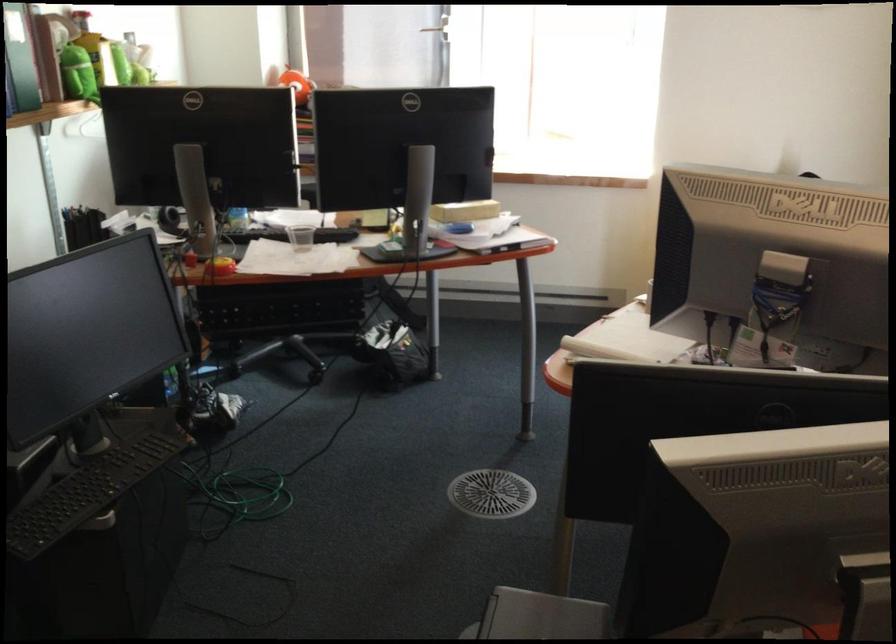
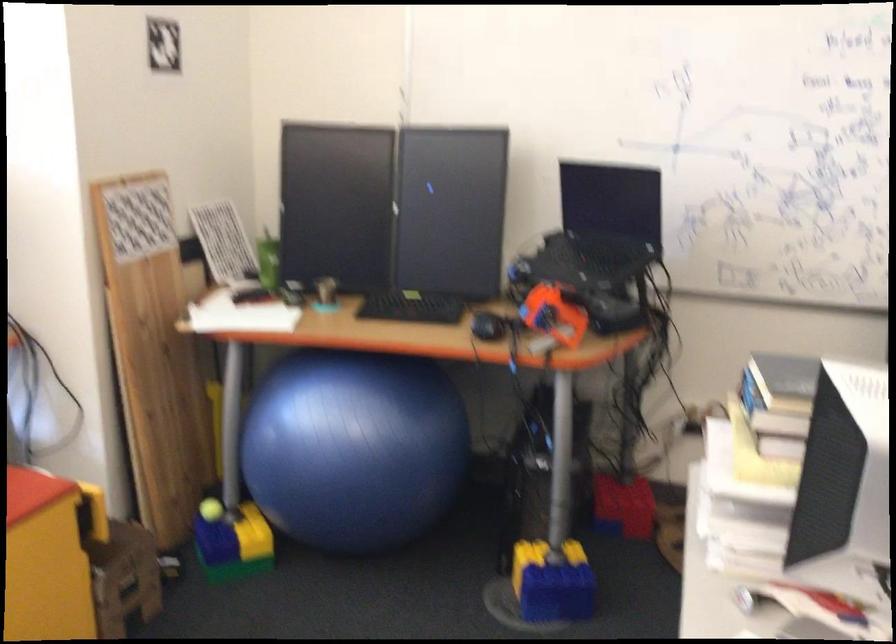
Question: The camera is either moving clockwise (left) or counter-clockwise (right) around the object. The first image is from the beginning of the video and the second image is from the end. Is the camera moving left or right when shooting the video?

Choices:
 (A) Left
 (B) Right

Answer: (A)